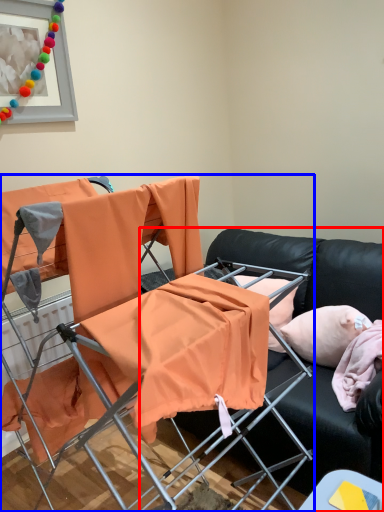
Question: Which object appears closest to the camera in this image, studio couch (highlighted by a red box) or chair (highlighted by a blue box)?

Choices:
 (A) studio couch
 (B) chair

Answer: (B)